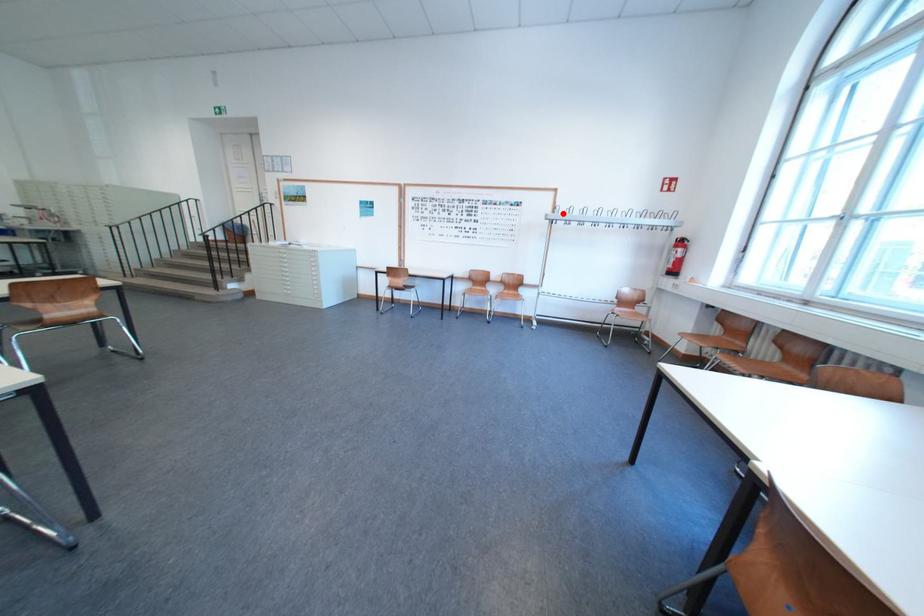
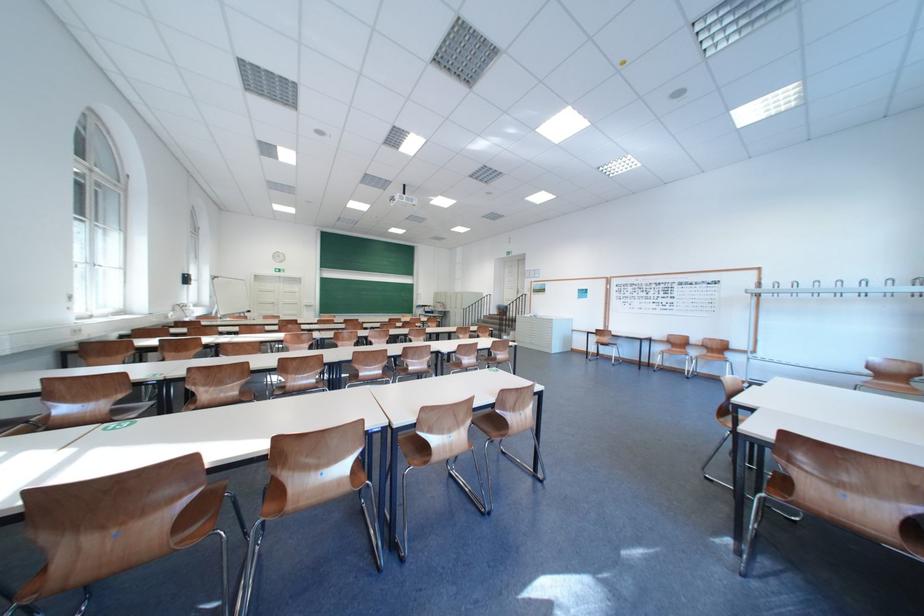
Question: I am providing you with two images of the same scene from different viewpoints. In image1, a red point is highlighted. Considering the same 3D point in image2, which of the following is correct?

Choices:
 (A) It is closer
 (B) It is farther

Answer: (B)